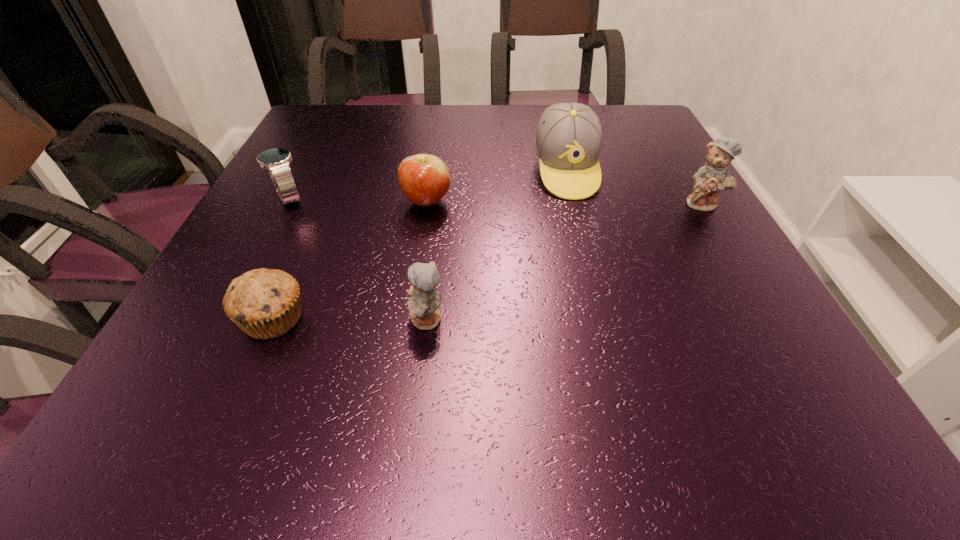
At what (x,y) coordinates should I click in order to perform the action: click on muffin that is at the left edge. Please return your answer as a coordinate pair (x, y). This screenshot has height=540, width=960. Looking at the image, I should click on (265, 303).

This screenshot has height=540, width=960. Identify the location of object located in the right edge section of the desktop. (715, 176).

Where is `object present at the near left corner`? Image resolution: width=960 pixels, height=540 pixels. object present at the near left corner is located at coordinates (265, 303).

Locate an element on the screen. vacant space at the far edge of the desktop is located at coordinates (367, 136).

Where is `free space at the near edge`? The height and width of the screenshot is (540, 960). free space at the near edge is located at coordinates (524, 372).

Locate an element on the screen. free location at the right edge of the desktop is located at coordinates (671, 159).

You are a GUI agent. You are given a task and a screenshot of the screen. Output one action in this format:
    pyautogui.click(x=<x>, y=<y>)
    Task: Click on the vacant area at the far left corner of the desktop
    The image size is (960, 540).
    Given the screenshot: What is the action you would take?
    pyautogui.click(x=309, y=122)

The image size is (960, 540). Find the location of `free point at the near left corner`. free point at the near left corner is located at coordinates (182, 340).

Image resolution: width=960 pixels, height=540 pixels. Find the location of `free spot at the far right corner of the desktop`. free spot at the far right corner of the desktop is located at coordinates (608, 127).

This screenshot has width=960, height=540. In order to click on vacant area that lies between the taller teddy bear and the watch in this screenshot , I will do `click(496, 201)`.